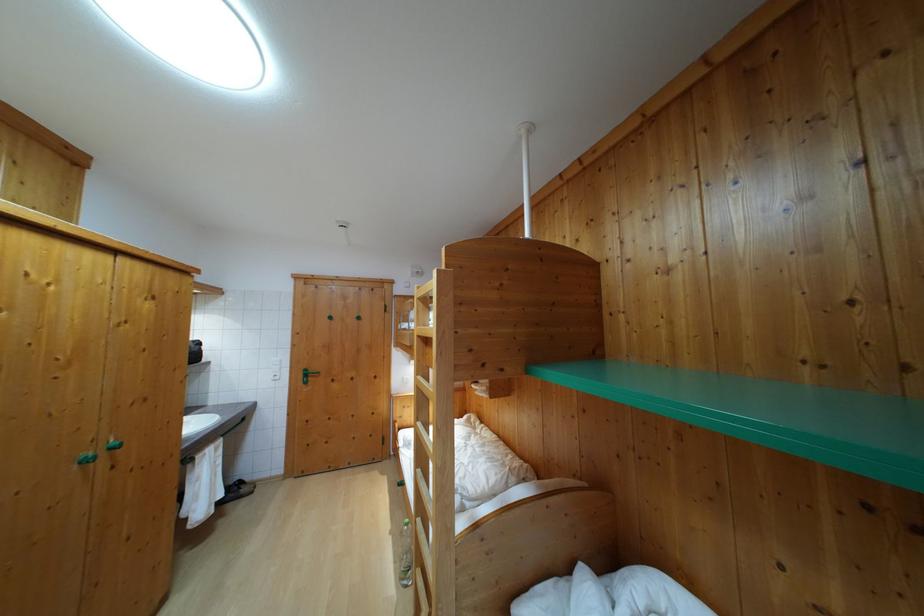
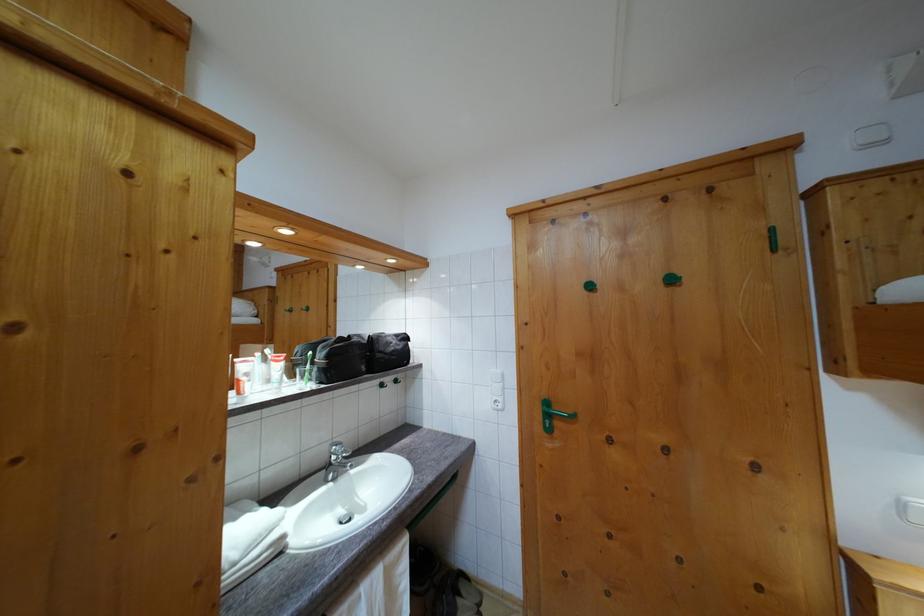
The point at (334, 325) is marked in the first image. Where is the corresponding point in the second image?

(593, 294)